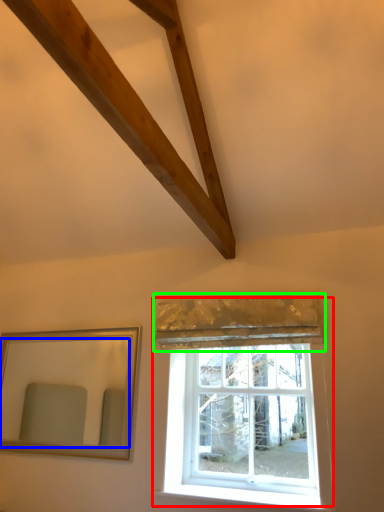
Question: Which is farther away from window (highlighted by a red box)? mirror (highlighted by a blue box) or curtain (highlighted by a green box)?

Choices:
 (A) mirror
 (B) curtain

Answer: (A)